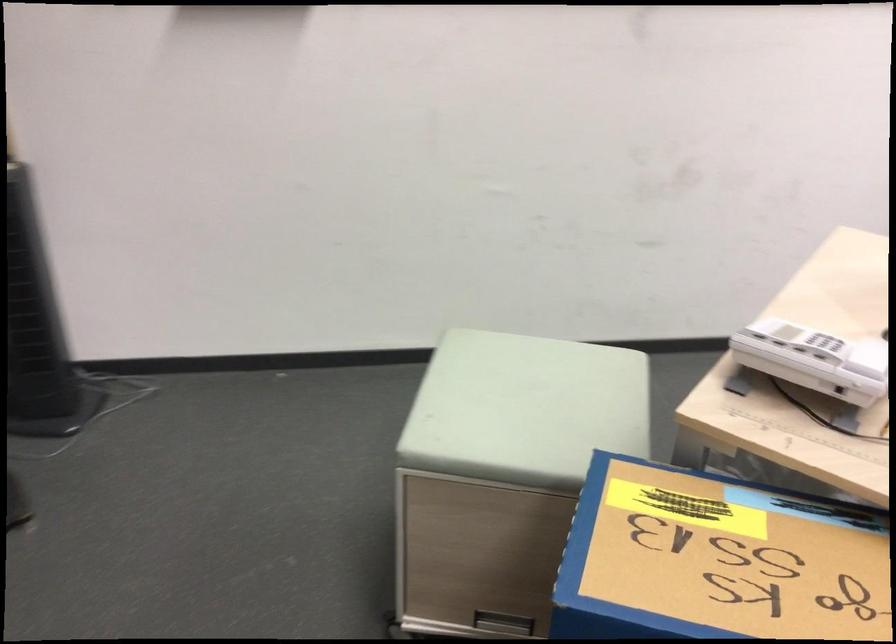
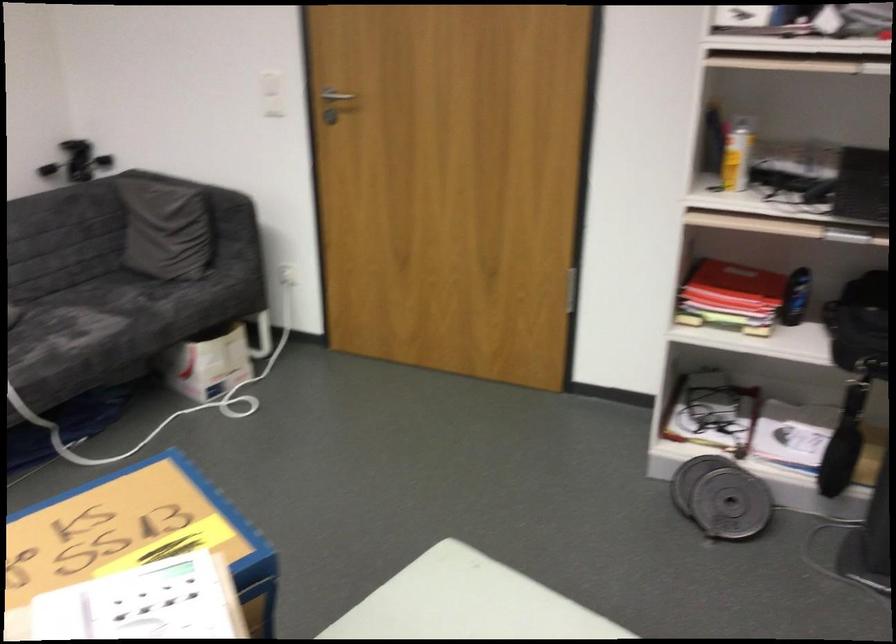
In the second image, find the point that corresponds to (693,571) in the first image.

(139, 535)